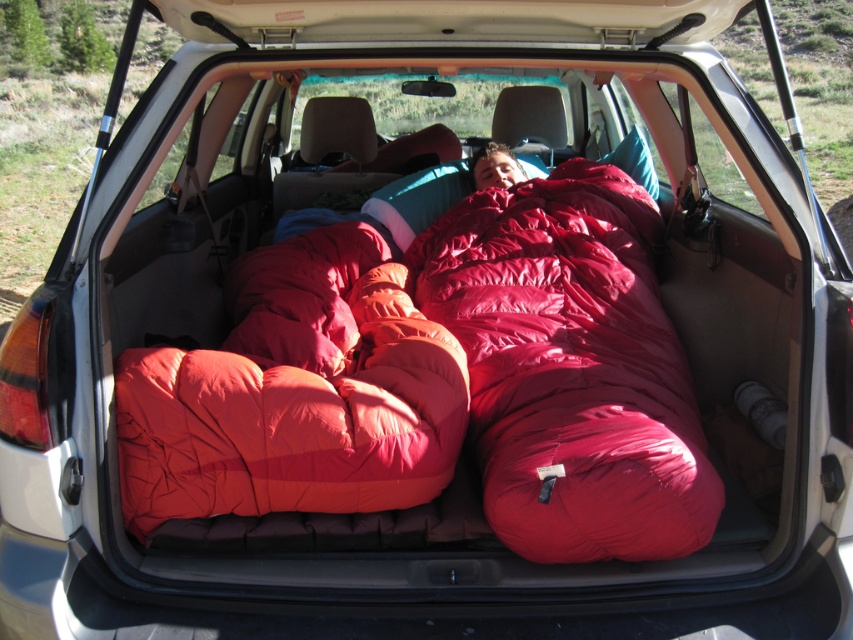
Can you confirm if matte orange sleeping bag at center is positioned to the left of smooth red sleeping bag at center?

Yes, matte orange sleeping bag at center is to the left of smooth red sleeping bag at center.

Between matte orange sleeping bag at center and smooth red sleeping bag at center, which one appears on the left side from the viewer's perspective?

Positioned to the left is matte orange sleeping bag at center.

The image size is (853, 640). What do you see at coordinates (294, 394) in the screenshot?
I see `matte orange sleeping bag at center` at bounding box center [294, 394].

Find the location of a particular element. matte orange sleeping bag at center is located at coordinates click(x=294, y=394).

Who is more forward, (544,324) or (480,180)?

Point (544,324)

Does shiny red sleeping bag at center appear under smooth red sleeping bag at center?

Yes.

Between point (450, 317) and point (498, 177), which one is positioned in front?

Point (450, 317) is in front.

The height and width of the screenshot is (640, 853). Identify the location of shiny red sleeping bag at center. (572, 368).

Based on the photo, which is below, shiny red sleeping bag at center or matte orange sleeping bag at center?

matte orange sleeping bag at center is lower down.

Between point (621, 205) and point (322, 497), which one is positioned in front?

Point (322, 497) is more forward.

Is point (611, 266) positioned after point (386, 474)?

Yes, it is behind point (386, 474).

Find the location of a particular element. shiny red sleeping bag at center is located at coordinates (572, 368).